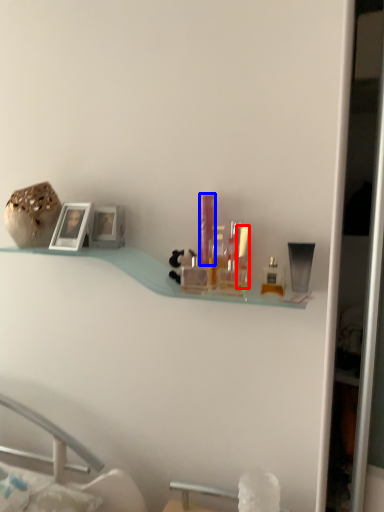
Question: Which point is further to the camera, toiletry (highlighted by a red box) or toiletry (highlighted by a blue box)?

Choices:
 (A) toiletry
 (B) toiletry

Answer: (B)